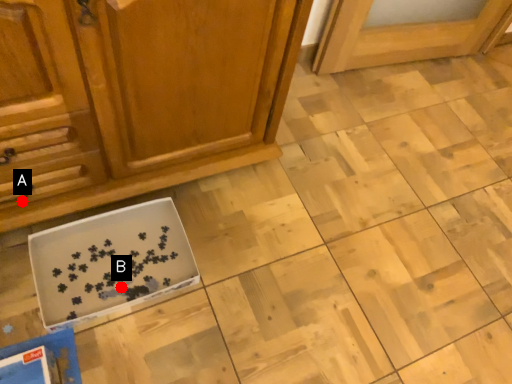
Question: Two points are circled on the image, labeled by A and B beside each circle. Which point is closer to the camera taking this photo?

Choices:
 (A) A is closer
 (B) B is closer

Answer: (A)